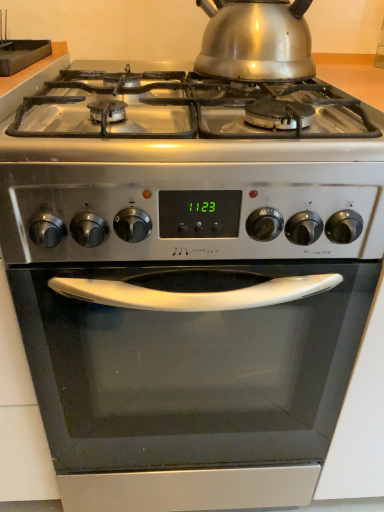
You are a GUI agent. You are given a task and a screenshot of the screen. Output one action in this format:
    pyautogui.click(x=<x>, y=<y>)
    Task: Click on the shiny metallic kettle at top
    The height and width of the screenshot is (512, 384).
    Given the screenshot: What is the action you would take?
    pyautogui.click(x=256, y=40)

The image size is (384, 512). What do you see at coordinates (256, 40) in the screenshot?
I see `shiny metallic kettle at top` at bounding box center [256, 40].

Image resolution: width=384 pixels, height=512 pixels. I want to click on shiny metallic kettle at top, so click(256, 40).